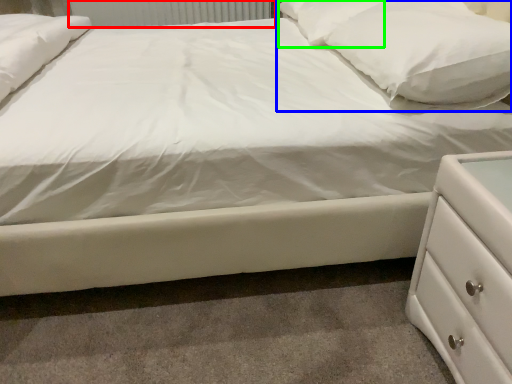
Question: Which object is positioned closest to radiator (highlighted by a red box)? Select from pillow (highlighted by a blue box) and pillow (highlighted by a green box).

Choices:
 (A) pillow
 (B) pillow

Answer: (B)